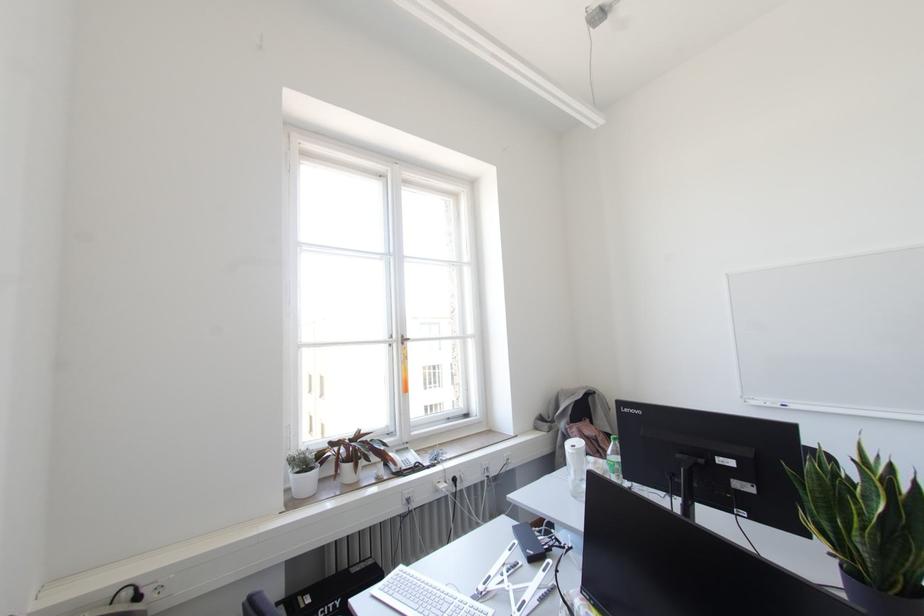
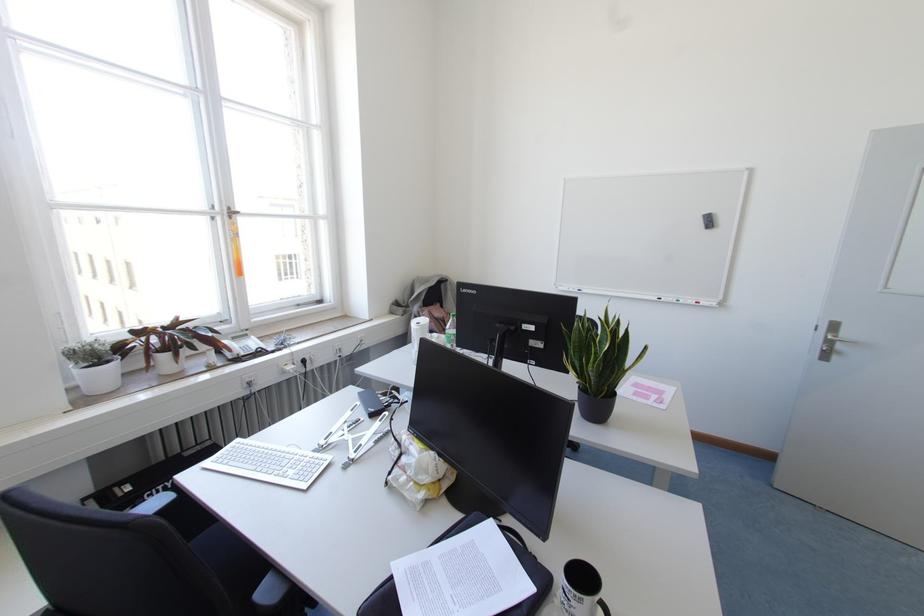
Find the pixel in the second image that matches [402,342] in the first image.

(229, 217)